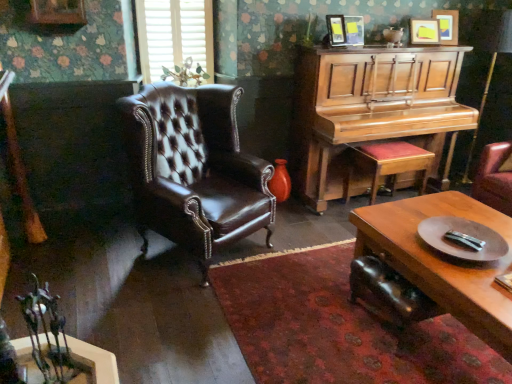
The image size is (512, 384). In order to click on free space between wooden polished coffee table at lower right and brown leather chair at left in this screenshot , I will do `click(300, 301)`.